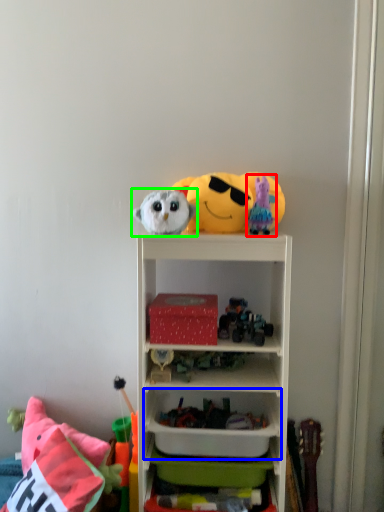
Question: Estimate the real-world distances between objects in this image. Which object is farther from toy (highlighted by a red box), cabinet (highlighted by a blue box) or toy (highlighted by a green box)?

Choices:
 (A) cabinet
 (B) toy

Answer: (A)